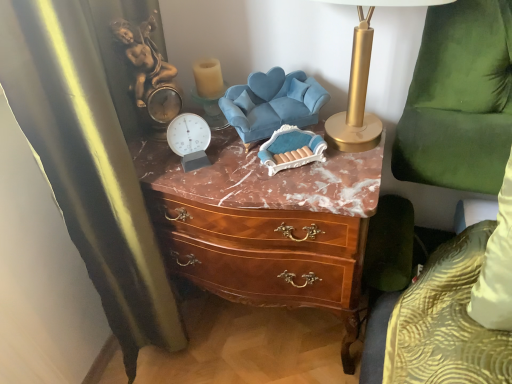
The height and width of the screenshot is (384, 512). Find the location of `free spot in front of velvet blue swivel chair at center, which is the 1th swivel chair from left to right`. free spot in front of velvet blue swivel chair at center, which is the 1th swivel chair from left to right is located at coordinates [285, 185].